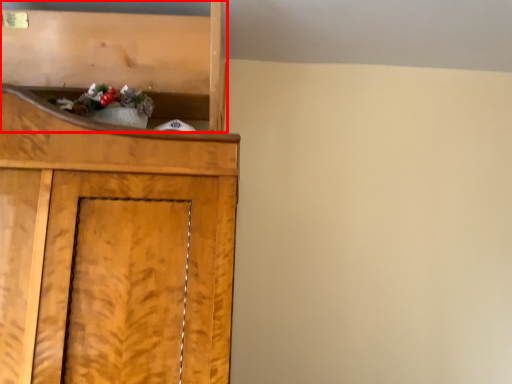
Question: From the image, what is the correct spatial relationship of shelf (annotated by the red box) in relation to christmas decoration?

Choices:
 (A) right
 (B) left

Answer: (B)